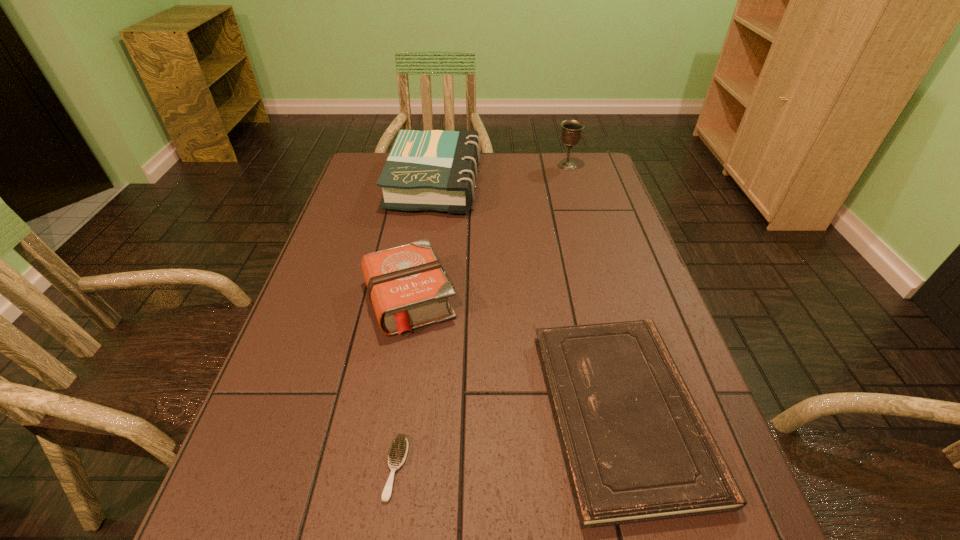
Locate an element on the screen. empty location between the tallest object and the right paperback book is located at coordinates (594, 289).

Find the location of a particular element. This screenshot has height=540, width=960. object identified as the third closest to the shortest object is located at coordinates (436, 170).

The height and width of the screenshot is (540, 960). Find the location of `object that stands as the fourth closest to the taller paperback book`. object that stands as the fourth closest to the taller paperback book is located at coordinates (398, 451).

I want to click on vacant space that satisfies the following two spatial constraints: 1. on the back side of the tallest object; 2. on the left side of the right paperback book, so (x=558, y=165).

The height and width of the screenshot is (540, 960). Find the location of `vacant space that satisfies the following two spatial constraints: 1. on the back side of the left paperback book; 2. on the right side of the tallest object`. vacant space that satisfies the following two spatial constraints: 1. on the back side of the left paperback book; 2. on the right side of the tallest object is located at coordinates (438, 165).